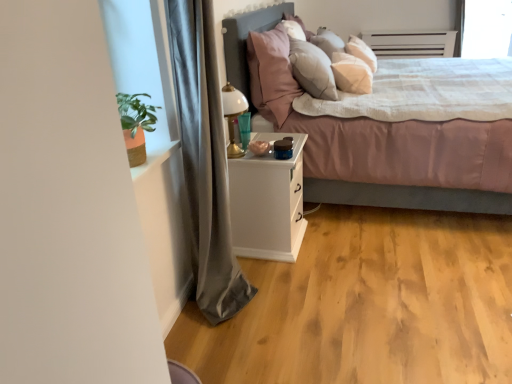
Where is `vacant point above white matte nightstand at center (from a real-world perspective)`? Image resolution: width=512 pixels, height=384 pixels. vacant point above white matte nightstand at center (from a real-world perspective) is located at coordinates (261, 147).